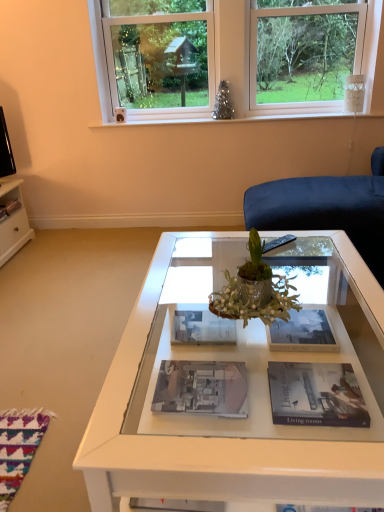
Question: Relative to green metallic vase at center, is white glossy magazine at center, the 4th magazine when ordered from front to back, in front or behind?

Choices:
 (A) front
 (B) behind

Answer: (B)

Question: From the image's perspective, is white glossy magazine at center, the second magazine positioned from the back, positioned above or below green metallic vase at center?

Choices:
 (A) above
 (B) below

Answer: (B)

Question: Estimate the real-world distances between objects in this image. Which object is farther from the matte black magazine at left, which ranks as the 5th magazine in front-to-back order?

Choices:
 (A) matte paper magazine at center, which ranks as the 1th magazine in right-to-left order
 (B) white plastic window at upper center
 (C) white glossy coffee table at center
 (D) matte paper magazine at center, acting as the fifth magazine starting from the top
 (E) green metallic vase at center

Answer: (D)

Question: Which is nearer to the matte black magazine at left, which ranks as the 5th magazine in front-to-back order?

Choices:
 (A) white plastic window at upper center
 (B) matte paper magazine at center, acting as the fifth magazine starting from the top
 (C) white glossy coffee table at center
 (D) matte paper magazine at center, which ranks as the 1th magazine in right-to-left order
 (E) matte black book at center, acting as the 2th magazine starting from the front

Answer: (A)